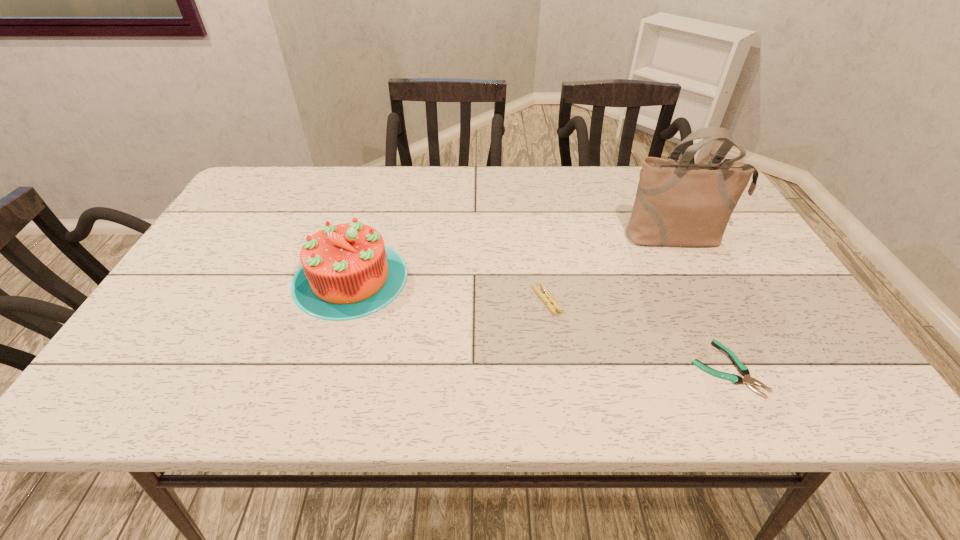
Where is `free space located on the back of the nearest object`? The height and width of the screenshot is (540, 960). free space located on the back of the nearest object is located at coordinates (663, 235).

Locate an element on the screen. The image size is (960, 540). object that is positioned at the near edge is located at coordinates (743, 370).

Where is `object present at the right edge`? The image size is (960, 540). object present at the right edge is located at coordinates (678, 203).

Image resolution: width=960 pixels, height=540 pixels. In the image, there is a desktop. Find the location of `vacant area at the far edge`. vacant area at the far edge is located at coordinates (598, 195).

What are the coordinates of `free space at the near edge of the desktop` in the screenshot? It's located at (225, 370).

This screenshot has width=960, height=540. Find the location of `vacant space at the left edge`. vacant space at the left edge is located at coordinates (181, 324).

You are a GUI agent. You are given a task and a screenshot of the screen. Output one action in this format:
    pyautogui.click(x=<x>, y=<y>)
    Task: Click on the free space at the right edge
    This screenshot has width=960, height=540.
    Given the screenshot: What is the action you would take?
    (707, 260)

Identify the location of free space between the cake and the clothespin. This screenshot has height=540, width=960. (448, 289).

At what (x,y) coordinates should I click in order to perform the action: click on unoccupied position between the shoulder bag and the third shortest object. Please return your answer as a coordinate pair (x, y). Looking at the image, I should click on (514, 258).

Image resolution: width=960 pixels, height=540 pixels. In order to click on blank region between the leftmost object and the clothespin in this screenshot , I will do `click(448, 289)`.